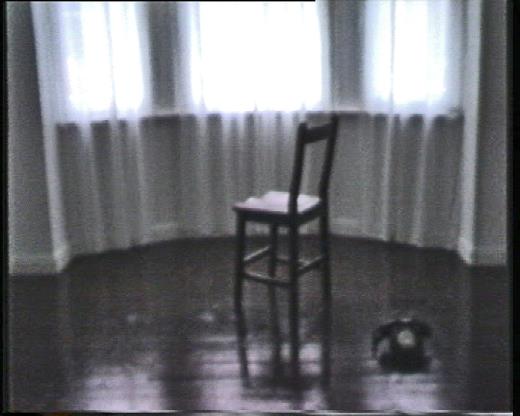
Image resolution: width=520 pixels, height=416 pixels. Identify the location of phone. (394, 339).